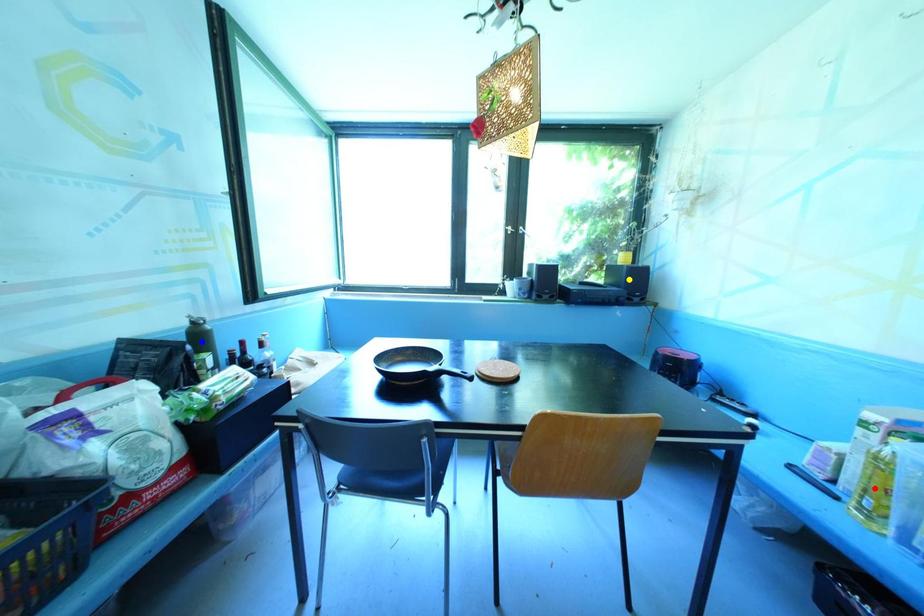
Order these from nearest to farthest:
yellow point
red point
blue point

red point → blue point → yellow point